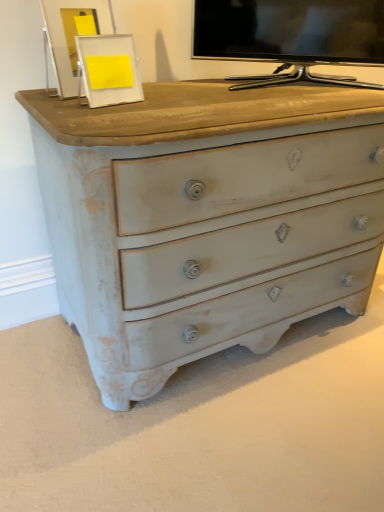
Question: From the image's perspective, is matte black tv at upper center above or below white matte picture frame at upper center?

Choices:
 (A) above
 (B) below

Answer: (A)

Question: Is matte black tv at upper center inside or outside of white matte picture frame at upper center?

Choices:
 (A) outside
 (B) inside

Answer: (A)

Question: From a real-world perspective, relative to white matte picture frame at upper center, is matte black tv at upper center vertically above or below?

Choices:
 (A) above
 (B) below

Answer: (A)

Question: From the image's perspective, is white matte picture frame at upper center located above or below matte black tv at upper center?

Choices:
 (A) below
 (B) above

Answer: (A)

Question: In the image, is white matte picture frame at upper center positioned in front of or behind matte black tv at upper center?

Choices:
 (A) front
 (B) behind

Answer: (A)

Question: Is white matte picture frame at upper center spatially inside matte black tv at upper center, or outside of it?

Choices:
 (A) outside
 (B) inside

Answer: (A)

Question: Considering the positions of point (87, 70) and point (284, 5), is point (87, 70) closer or farther from the camera than point (284, 5)?

Choices:
 (A) farther
 (B) closer

Answer: (B)